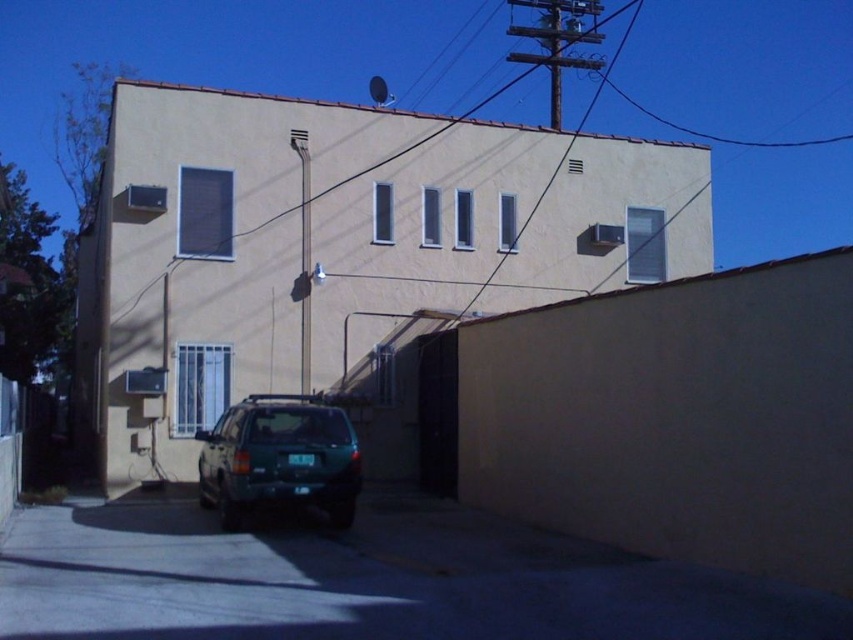
Question: Is dark gray asphalt at lower center to the left of green matte suv at center from the viewer's perspective?

Choices:
 (A) yes
 (B) no

Answer: (B)

Question: Considering the real-world distances, which object is closest to the green matte suv at center?

Choices:
 (A) dark gray asphalt at lower center
 (B) brown wire at upper center

Answer: (A)

Question: Which of the following is the closest to the observer?

Choices:
 (A) green matte suv at center
 (B) dark gray asphalt at lower center

Answer: (B)

Question: Is green matte suv at center above brown wire at upper center?

Choices:
 (A) no
 (B) yes

Answer: (A)

Question: Which point is farther from the camera taking this photo?

Choices:
 (A) (436, 605)
 (B) (329, 451)
 (C) (265, 221)

Answer: (C)

Question: Is dark gray asphalt at lower center closer to the viewer compared to green matte suv at center?

Choices:
 (A) no
 (B) yes

Answer: (B)